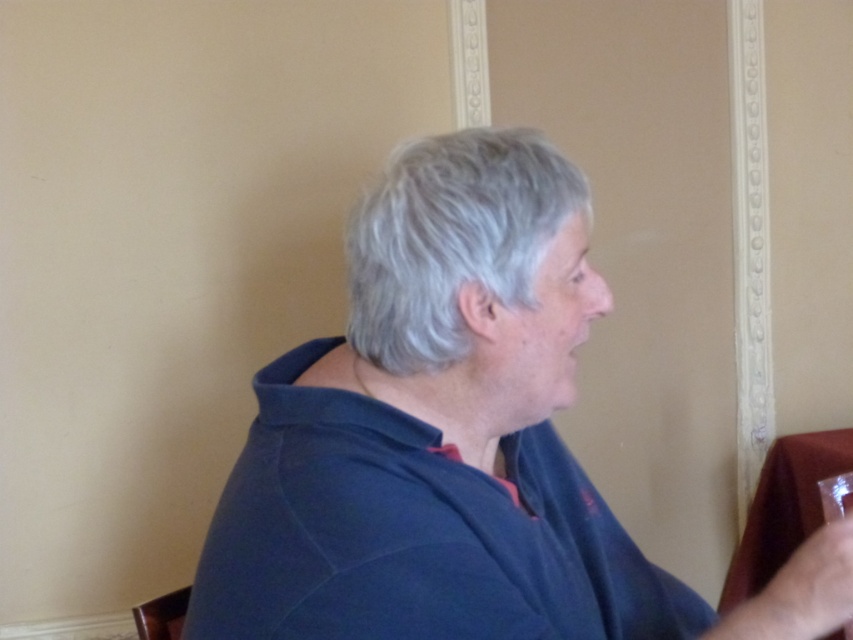
Is dark blue shirt at center taller than clear glass wine glass at right?

Indeed, dark blue shirt at center has a greater height compared to clear glass wine glass at right.

Between point (397, 422) and point (839, 502), which one is positioned in front?

Positioned in front is point (397, 422).

Does point (386, 193) come behind point (844, 492)?

No.

Find the location of `dark blue shirt at center`. dark blue shirt at center is located at coordinates (457, 440).